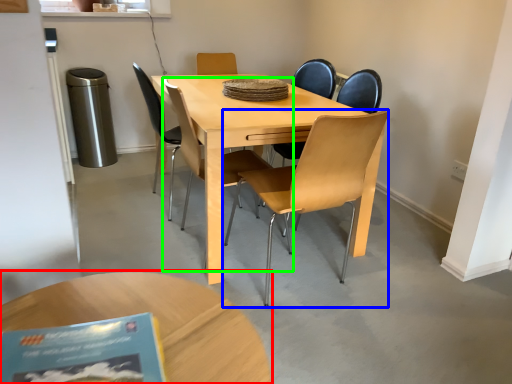
Question: Which object is the closest to the coffee table (highlighted by a red box)? Choose among these: chair (highlighted by a blue box) or chair (highlighted by a green box).

Choices:
 (A) chair
 (B) chair

Answer: (A)